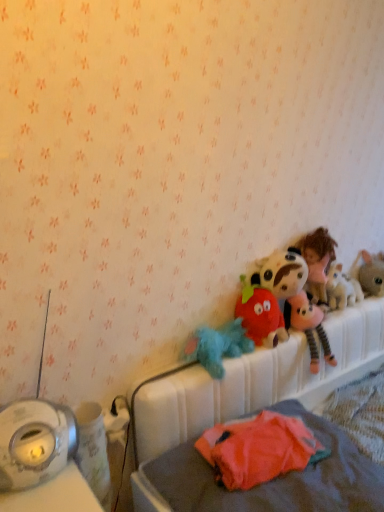
Question: Is fluffy plush strawberry at center, which is the third toy in left-to-right order, thinner than fluffy plush toy at upper right, which is the second toy from right to left?

Choices:
 (A) yes
 (B) no

Answer: (B)

Question: Considering the relative positions of fluffy plush strawberry at center, which is the third toy in left-to-right order, and fluffy plush toy at upper right, arranged as the fourth toy when viewed from the left, in the image provided, is fluffy plush strawberry at center, which is the third toy in left-to-right order, to the left of fluffy plush toy at upper right, arranged as the fourth toy when viewed from the left, from the viewer's perspective?

Choices:
 (A) no
 (B) yes

Answer: (B)

Question: Is fluffy plush strawberry at center, arranged as the 3th toy when viewed from the right, outside fluffy plush toy at upper right, which is the second toy from right to left?

Choices:
 (A) yes
 (B) no

Answer: (A)

Question: Does fluffy plush strawberry at center, arranged as the 3th toy when viewed from the right, come in front of fluffy plush toy at upper right, arranged as the fourth toy when viewed from the left?

Choices:
 (A) yes
 (B) no

Answer: (A)

Question: From the image's perspective, is fluffy plush strawberry at center, which is the third toy in left-to-right order, over fluffy plush toy at upper right, which is the second toy from right to left?

Choices:
 (A) no
 (B) yes

Answer: (A)

Question: Is fluffy blue plush at center, the fifth toy viewed from the right, in front of or behind fluffy plush strawberry at center, which is the third toy in left-to-right order, in the image?

Choices:
 (A) behind
 (B) front

Answer: (B)

Question: From a real-world perspective, is fluffy blue plush at center, the fifth toy viewed from the right, above or below fluffy plush strawberry at center, which is the third toy in left-to-right order?

Choices:
 (A) above
 (B) below

Answer: (B)

Question: Is fluffy blue plush at center, the fifth toy viewed from the right, wider or thinner than fluffy plush strawberry at center, arranged as the 3th toy when viewed from the right?

Choices:
 (A) wide
 (B) thin

Answer: (A)

Question: Looking at the image, does fluffy blue plush at center, the fifth toy viewed from the right, seem bigger or smaller compared to fluffy plush strawberry at center, which is the third toy in left-to-right order?

Choices:
 (A) big
 (B) small

Answer: (B)

Question: Considering their positions, is fluffy pink plush at upper right located in front of or behind fluffy plush toy at upper right, which is the second toy from right to left?

Choices:
 (A) front
 (B) behind

Answer: (A)

Question: Considering the positions of fluffy pink plush at upper right and fluffy plush toy at upper right, which is the second toy from right to left, in the image, is fluffy pink plush at upper right wider or thinner than fluffy plush toy at upper right, which is the second toy from right to left,?

Choices:
 (A) wide
 (B) thin

Answer: (A)

Question: Considering the relative positions of fluffy pink plush at upper right and fluffy plush toy at upper right, arranged as the fourth toy when viewed from the left, in the image provided, is fluffy pink plush at upper right to the left or to the right of fluffy plush toy at upper right, arranged as the fourth toy when viewed from the left,?

Choices:
 (A) left
 (B) right

Answer: (A)

Question: In terms of height, does fluffy pink plush at upper right look taller or shorter compared to fluffy plush toy at upper right, arranged as the fourth toy when viewed from the left?

Choices:
 (A) tall
 (B) short

Answer: (A)

Question: Does point (203, 355) appear closer or farther from the camera than point (193, 409)?

Choices:
 (A) farther
 (B) closer

Answer: (A)

Question: Considering their positions, is fluffy blue plush at center, the fifth toy viewed from the right, located in front of or behind white plastic hospital bed at upper right?

Choices:
 (A) front
 (B) behind

Answer: (B)